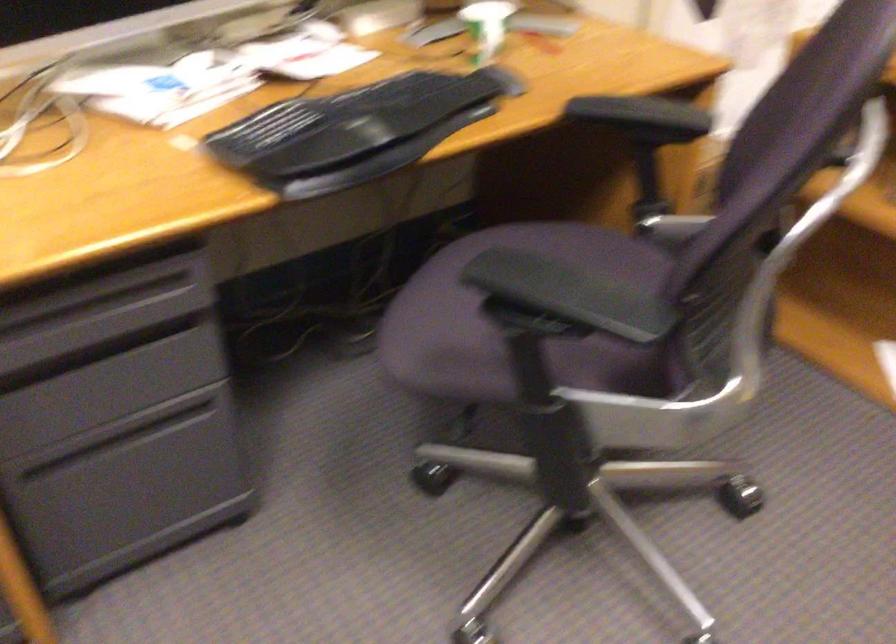
The height and width of the screenshot is (644, 896). Describe the element at coordinates (564, 289) in the screenshot. I see `the chair sitting surface` at that location.